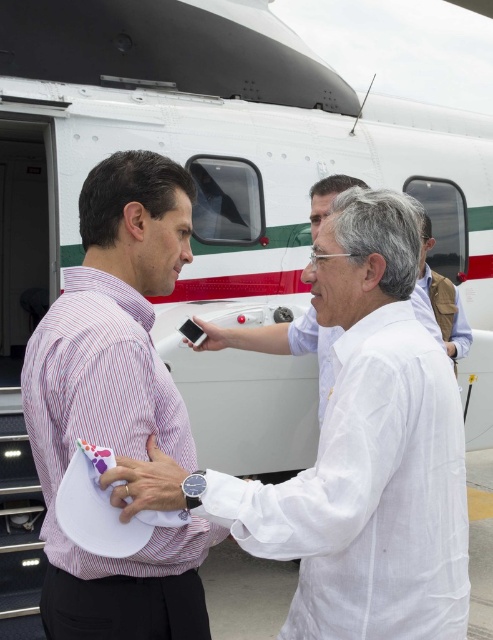
Between white cotton shirt at center and matte black phone at center, which one appears on the right side from the viewer's perspective?

Positioned to the right is white cotton shirt at center.

Does white cotton shirt at center appear on the left side of matte black phone at center?

In fact, white cotton shirt at center is to the right of matte black phone at center.

In order to click on white cotton shirt at center in this screenshot , I will do `click(367, 452)`.

Where is `white cotton shirt at center`? The height and width of the screenshot is (640, 493). white cotton shirt at center is located at coordinates (367, 452).

Is point (183, 508) closer to camera compared to point (195, 332)?

Yes.

Find the location of `matte white paper at center`. matte white paper at center is located at coordinates click(145, 483).

Identify the location of matte white paper at center. The width and height of the screenshot is (493, 640). (145, 483).

Can you confirm if white cotton shirt at center is taller than matte white paper at center?

Yes.

Where is `white cotton shirt at center`? The width and height of the screenshot is (493, 640). white cotton shirt at center is located at coordinates (367, 452).

Where is `white cotton shirt at center`? Image resolution: width=493 pixels, height=640 pixels. white cotton shirt at center is located at coordinates (367, 452).

The width and height of the screenshot is (493, 640). I want to click on white cotton shirt at center, so click(x=367, y=452).